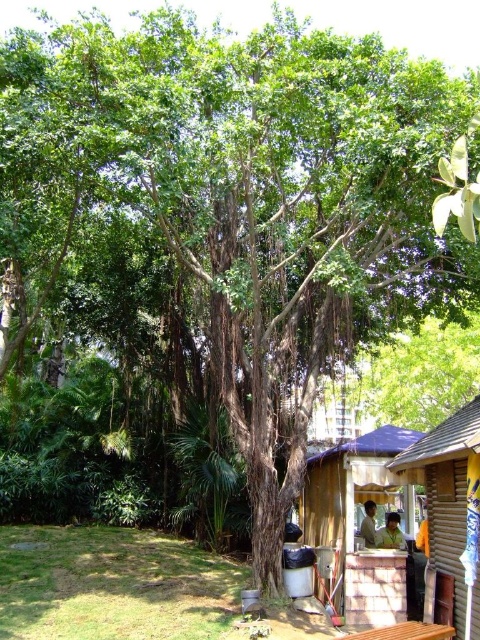
Is wooden hut at lower right shorter than brown wooden hut at lower right?

Indeed, wooden hut at lower right has a lesser height compared to brown wooden hut at lower right.

The image size is (480, 640). Identify the location of wooden hut at lower right. (348, 499).

Find the location of a particular element. wooden hut at lower right is located at coordinates (348, 499).